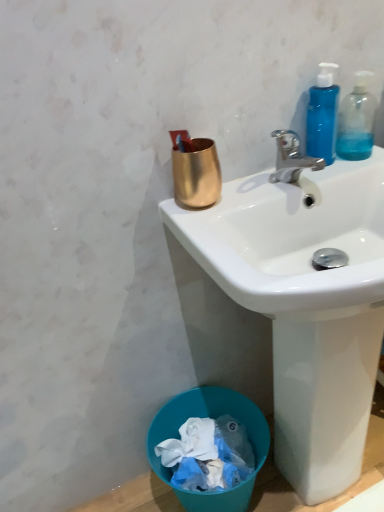
Locate an element on the screen. This screenshot has height=512, width=384. empty space that is in between transparent plastic bottle at upper right, placed as the 1th bottle when sorted from right to left, and polished chrome faucet at upper right is located at coordinates (335, 169).